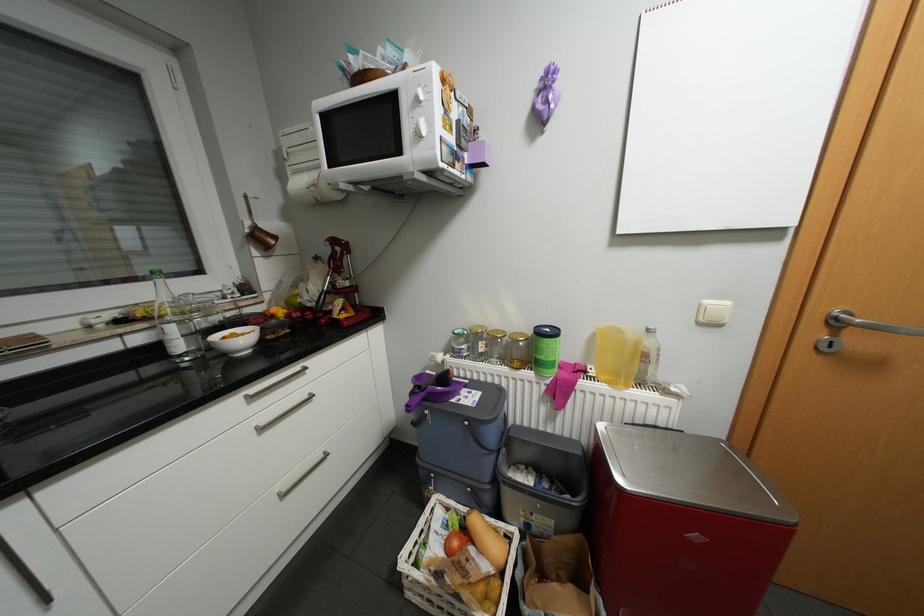
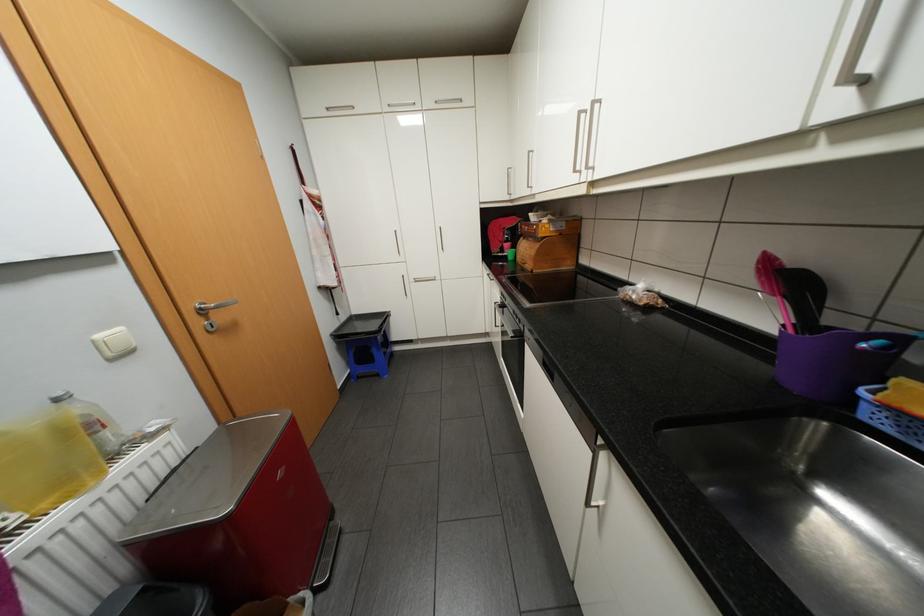
Locate, in the second image, the point that corresponds to the point at 714,301 in the first image.

(106, 334)